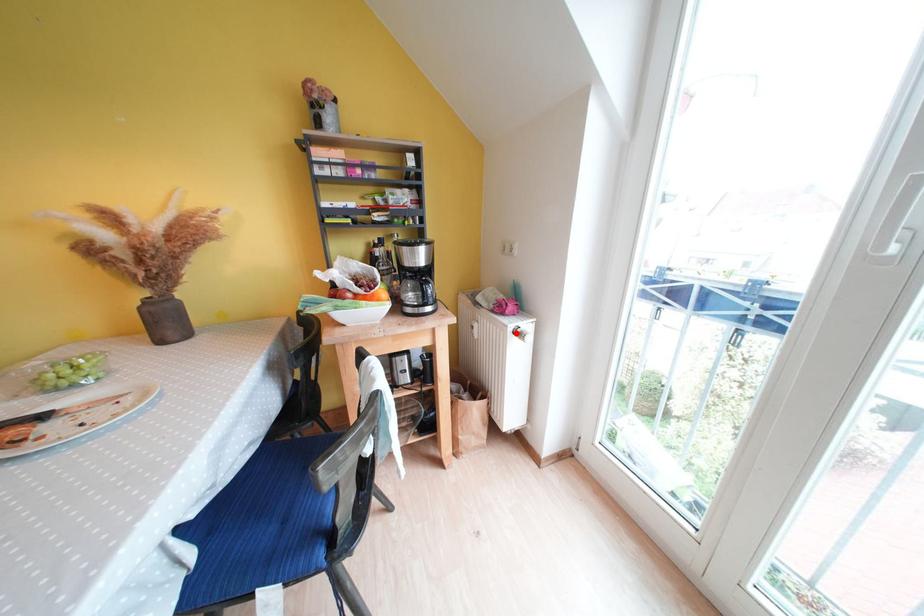
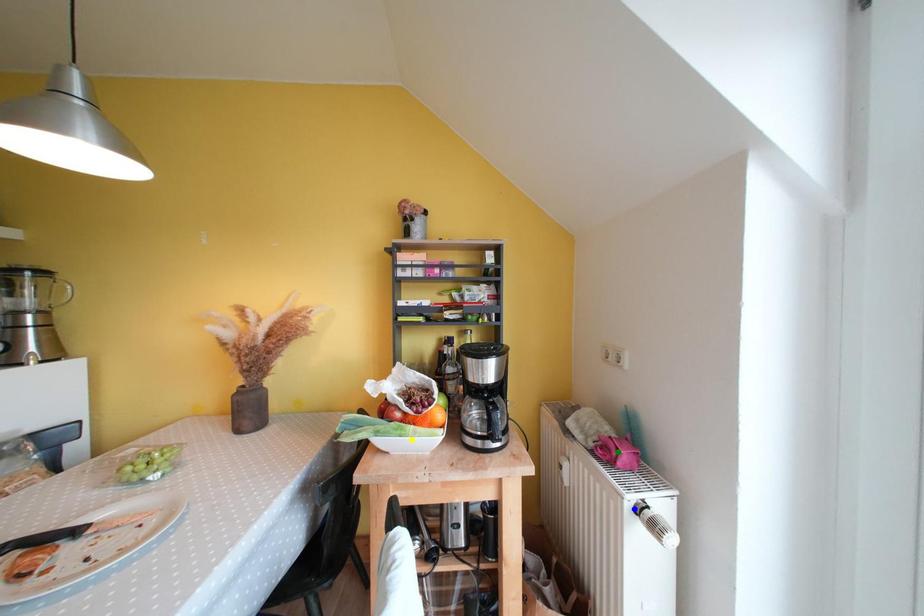
Question: I am providing you with two images of the same scene from different viewpoints. A red point is marked on the first image. You are given multiple points on the second image. Can you choose the point in image 2 that corresponds to the point in image 1?

Choices:
 (A) yellow point
 (B) green point
 (C) blue point

Answer: (C)